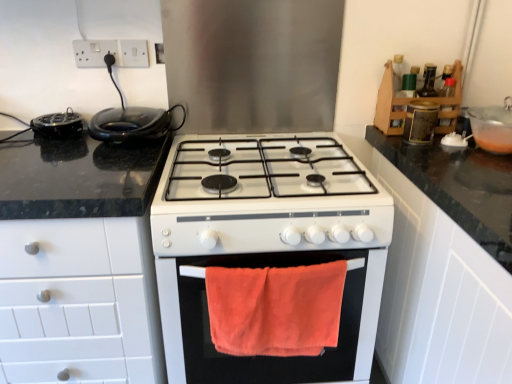
Question: Is metallic gold canister at upper right, which is the first appliance in top-to-bottom order, to the left of white plastic socket at upper center, the 1th electric outlet viewed from the right, from the viewer's perspective?

Choices:
 (A) no
 (B) yes

Answer: (A)

Question: Does metallic gold canister at upper right, which is the first appliance in top-to-bottom order, have a smaller size compared to white plastic socket at upper center, the 1th electric outlet viewed from the right?

Choices:
 (A) yes
 (B) no

Answer: (B)

Question: Is metallic gold canister at upper right, the fourth appliance in the bottom-to-top sequence, positioned behind white plastic socket at upper center, the 1th electric outlet viewed from the right?

Choices:
 (A) yes
 (B) no

Answer: (B)

Question: From a real-world perspective, is metallic gold canister at upper right, which ranks as the third appliance in left-to-right order, positioned over white plastic socket at upper center, which is the 2th electric outlet in left-to-right order, based on gravity?

Choices:
 (A) yes
 (B) no

Answer: (B)

Question: Is metallic gold canister at upper right, which is the 2th appliance from right to left, positioned with its back to white plastic socket at upper center, the 1th electric outlet viewed from the right?

Choices:
 (A) yes
 (B) no

Answer: (B)

Question: From a real-world perspective, is metallic gold canister at upper right, the fourth appliance in the bottom-to-top sequence, above or below wooden spice rack at upper right, which ranks as the second cabinetry in left-to-right order?

Choices:
 (A) above
 (B) below

Answer: (B)

Question: Relative to wooden spice rack at upper right, which ranks as the second cabinetry in bottom-to-top order, is metallic gold canister at upper right, which is the first appliance in top-to-bottom order, in front or behind?

Choices:
 (A) behind
 (B) front

Answer: (B)

Question: In the image, is metallic gold canister at upper right, the fourth appliance in the bottom-to-top sequence, on the left side or the right side of wooden spice rack at upper right, which ranks as the second cabinetry in bottom-to-top order?

Choices:
 (A) right
 (B) left

Answer: (B)

Question: Considering the positions of point (430, 134) and point (389, 69), is point (430, 134) closer or farther from the camera than point (389, 69)?

Choices:
 (A) closer
 (B) farther

Answer: (A)

Question: Considering the positions of white matte cabinet at left, which ranks as the 1th cabinetry in bottom-to-top order, and white plastic socket at upper center, the 1th electric outlet viewed from the right, in the image, is white matte cabinet at left, which ranks as the 1th cabinetry in bottom-to-top order, bigger or smaller than white plastic socket at upper center, the 1th electric outlet viewed from the right,?

Choices:
 (A) big
 (B) small

Answer: (A)

Question: From their relative heights in the image, would you say white matte cabinet at left, which is counted as the 1th cabinetry, starting from the left, is taller or shorter than white plastic socket at upper center, which is the 2th electric outlet in left-to-right order?

Choices:
 (A) tall
 (B) short

Answer: (A)

Question: Considering the positions of white matte cabinet at left, which ranks as the 1th cabinetry in bottom-to-top order, and white plastic socket at upper center, the 1th electric outlet viewed from the right, in the image, is white matte cabinet at left, which ranks as the 1th cabinetry in bottom-to-top order, wider or thinner than white plastic socket at upper center, the 1th electric outlet viewed from the right,?

Choices:
 (A) thin
 (B) wide

Answer: (B)

Question: Is white matte cabinet at left, which ranks as the 1th cabinetry in bottom-to-top order, to the left or to the right of white plastic socket at upper center, which is the 2th electric outlet in left-to-right order, in the image?

Choices:
 (A) right
 (B) left

Answer: (B)

Question: In terms of height, does white matte cabinet at left, the second cabinetry in the top-to-bottom sequence, look taller or shorter compared to translucent plastic bowl at upper right, marked as the fourth appliance in a left-to-right arrangement?

Choices:
 (A) tall
 (B) short

Answer: (A)

Question: Considering the relative positions of white matte cabinet at left, which is counted as the 1th cabinetry, starting from the left, and translucent plastic bowl at upper right, marked as the fourth appliance in a left-to-right arrangement, in the image provided, is white matte cabinet at left, which is counted as the 1th cabinetry, starting from the left, to the left or to the right of translucent plastic bowl at upper right, marked as the fourth appliance in a left-to-right arrangement,?

Choices:
 (A) left
 (B) right

Answer: (A)